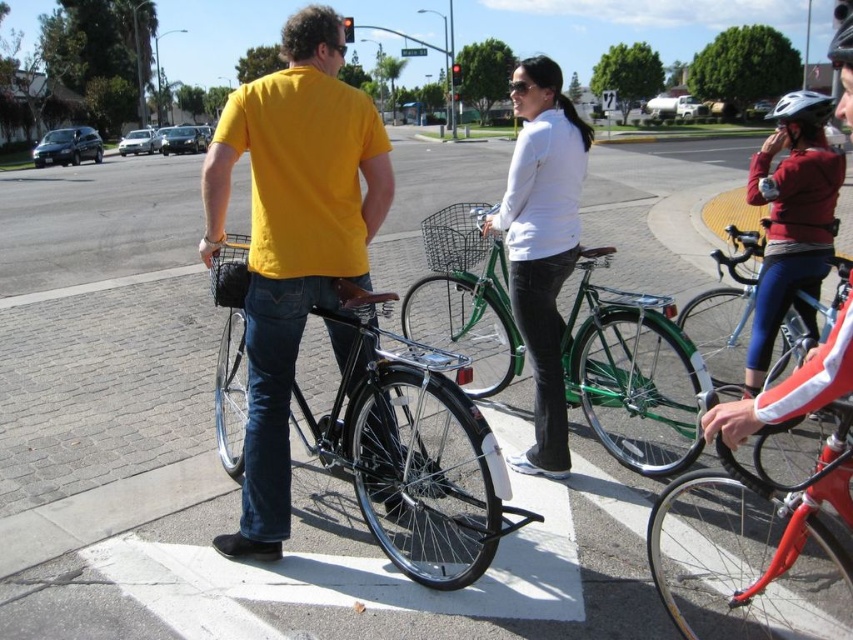
Question: Estimate the real-world distances between objects in this image. Which object is farther from the shiny red bicycle at right?

Choices:
 (A) shiny red bicycle at lower right
 (B) white matte jacket at center
 (C) matte yellow t-shirt at center

Answer: (C)

Question: Which is nearer to the green metallic bicycle at center?

Choices:
 (A) shiny red bicycle at lower right
 (B) shiny black bicycle at center

Answer: (A)

Question: Does shiny black bicycle at center have a smaller size compared to shiny red bicycle at lower right?

Choices:
 (A) no
 (B) yes

Answer: (A)

Question: Is matte yellow t-shirt at center to the right of black matte helmet at upper right from the viewer's perspective?

Choices:
 (A) yes
 (B) no

Answer: (B)

Question: Is shiny black bicycle at center bigger than green metallic bicycle at center?

Choices:
 (A) no
 (B) yes

Answer: (A)

Question: Which point is closer to the camera taking this photo?

Choices:
 (A) (790, 100)
 (B) (270, 358)

Answer: (B)